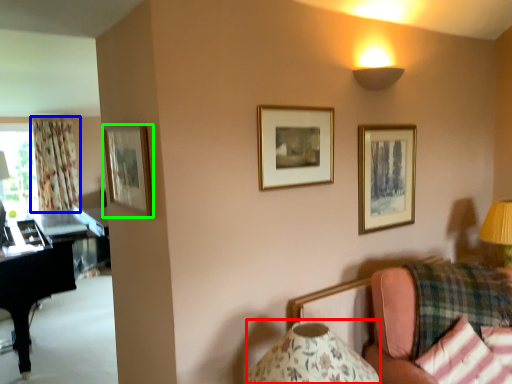
Question: Considering the real-world distances, which object is farthest from table lamp (highlighted by a red box)? curtain (highlighted by a blue box) or picture frame (highlighted by a green box)?

Choices:
 (A) curtain
 (B) picture frame

Answer: (A)